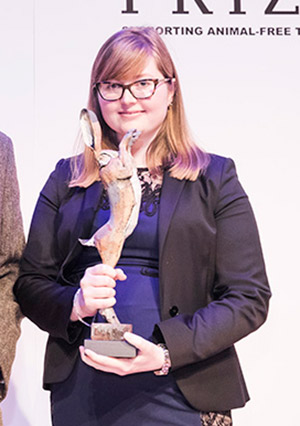
Where is `rabbit statue`? rabbit statue is located at coordinates (127, 211).